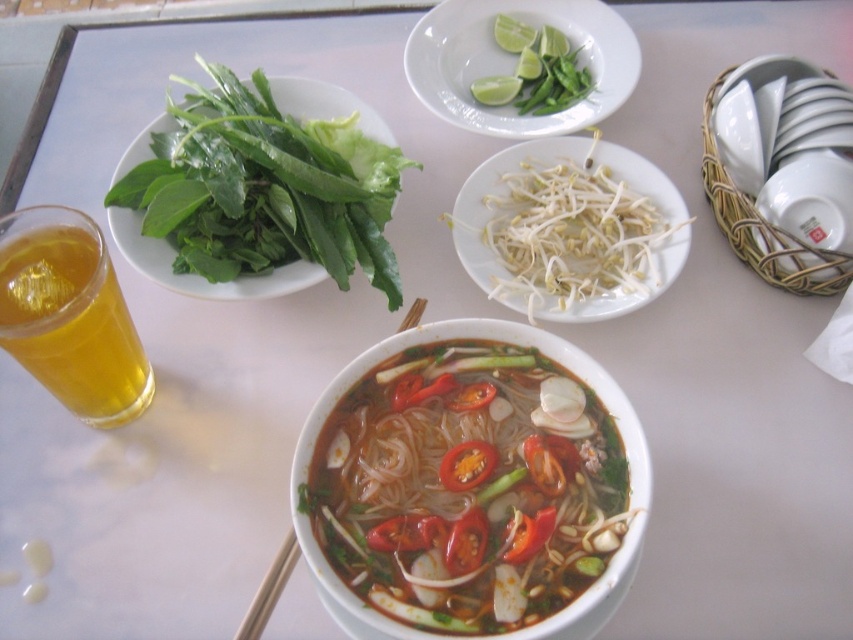
You are a diner who wants to eat the translucent glass noodles at center. To reach them, you need to move the wooden chopsticks at center. Is the noodles under the chopsticks?

The translucent glass noodles at center is located below wooden chopsticks at center, so yes, the noodles are under the chopsticks.

You are sitting at the table and want to reach both the pho bowl and the drink glass. Which object is closer to you, the point at position (207, 173) or the point at (814, 252)?

The point at position (207, 173) is closer to you than the point at (814, 252).